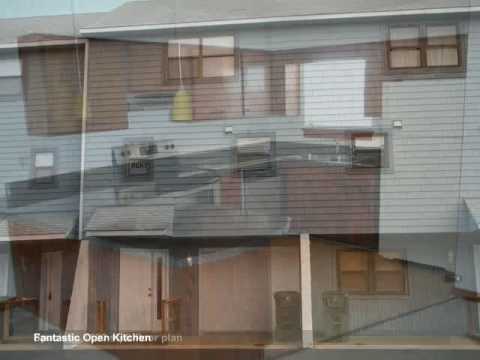
Where is `dishwasher`? dishwasher is located at coordinates (260, 188), (257, 165), (264, 205).